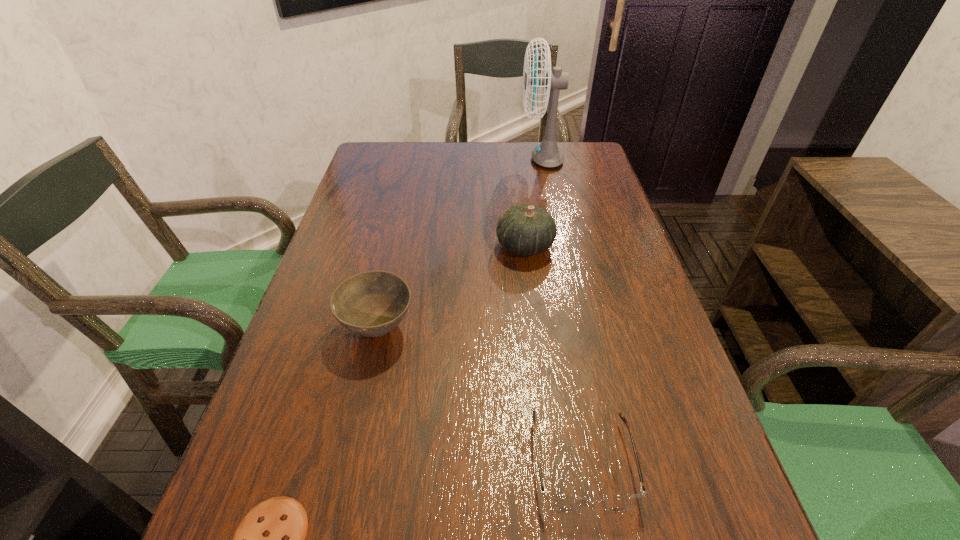
You are a GUI agent. You are given a task and a screenshot of the screen. Output one action in this format:
    pyautogui.click(x=<x>, y=<y>)
    Task: Click on the fan
    The image size is (960, 540).
    Given the screenshot: What is the action you would take?
    pyautogui.click(x=547, y=154)

This screenshot has height=540, width=960. Identify the location of the farthest object. (547, 154).

Where is `gourd`? The width and height of the screenshot is (960, 540). gourd is located at coordinates (525, 229).

Image resolution: width=960 pixels, height=540 pixels. In order to click on the fourth shortest object in this screenshot , I will do `click(525, 229)`.

At what (x,y) coordinates should I click in order to perform the action: click on the third tallest object. Please return your answer as a coordinate pair (x, y). The height and width of the screenshot is (540, 960). Looking at the image, I should click on click(373, 303).

Where is `bowl`? The image size is (960, 540). bowl is located at coordinates (373, 303).

Image resolution: width=960 pixels, height=540 pixels. In order to click on spectacles in this screenshot , I will do `click(559, 502)`.

At what (x,y) coordinates should I click in order to perform the action: click on free space located on the front-facing side of the fan. Please return your answer as a coordinate pair (x, y). This screenshot has width=960, height=540. Looking at the image, I should click on (458, 159).

Identify the location of vacant point located 0.350m on the front-facing side of the fan. click(412, 159).

Where is `vacant space located on the front-facing side of the fan`? The width and height of the screenshot is (960, 540). vacant space located on the front-facing side of the fan is located at coordinates (495, 159).